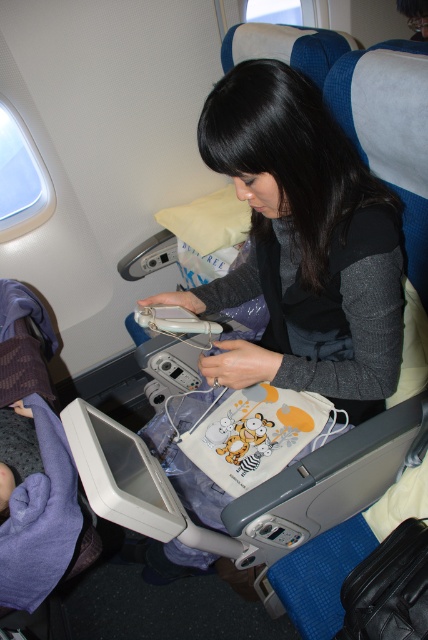
Question: Among these objects, which one is farthest from the camera?

Choices:
 (A) matte gray sweater at center
 (B) purple soft blanket at lower left

Answer: (B)

Question: Which point is farther to the camera?

Choices:
 (A) (0, 499)
 (B) (279, 256)

Answer: (B)

Question: Is matte gray sweater at center positioned at the back of purple soft blanket at lower left?

Choices:
 (A) no
 (B) yes

Answer: (A)

Question: Is matte gray sweater at center further to the viewer compared to purple soft blanket at lower left?

Choices:
 (A) yes
 (B) no

Answer: (B)

Question: Does matte gray sweater at center appear under purple soft blanket at lower left?

Choices:
 (A) yes
 (B) no

Answer: (B)